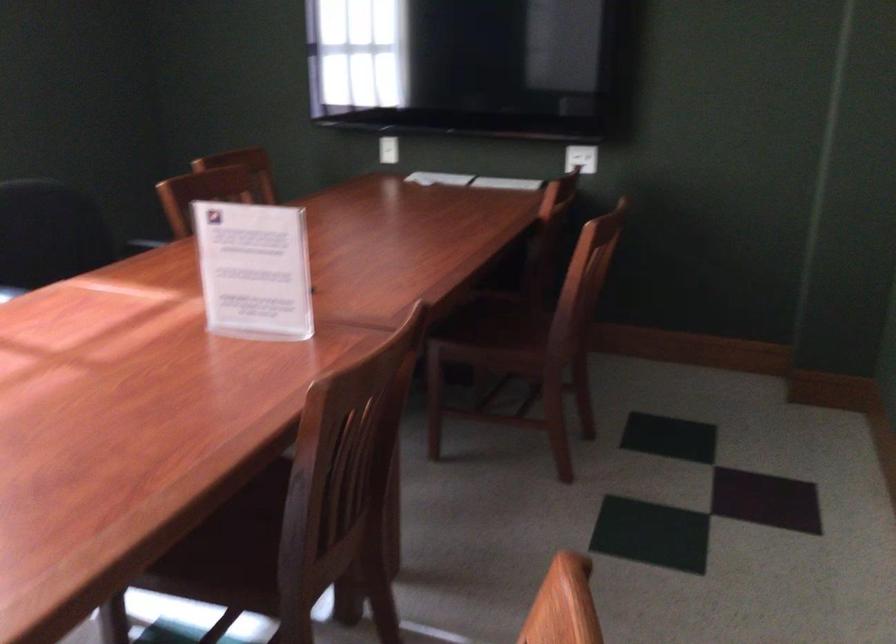
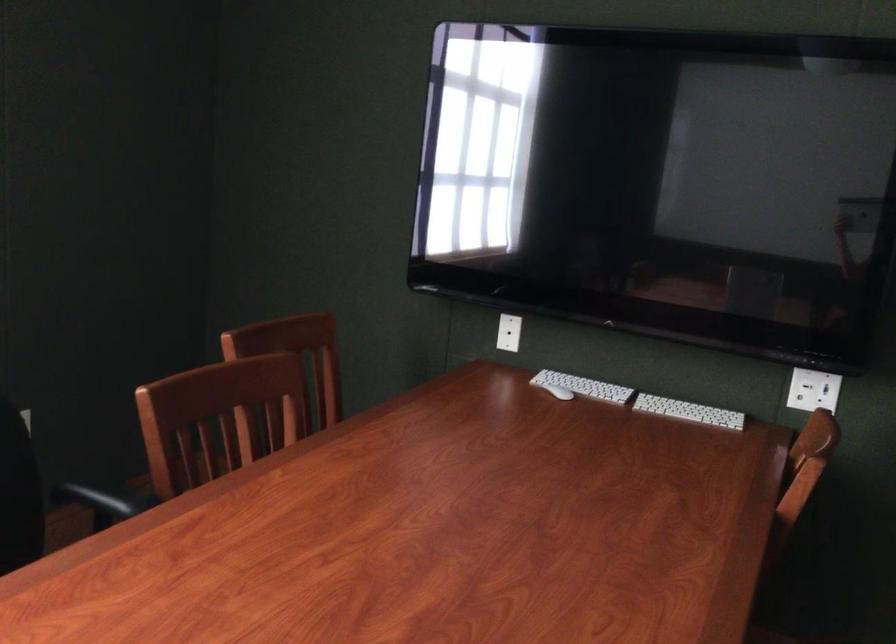
Find the pixel in the second image that matches pixel 389 146 in the first image.

(509, 333)